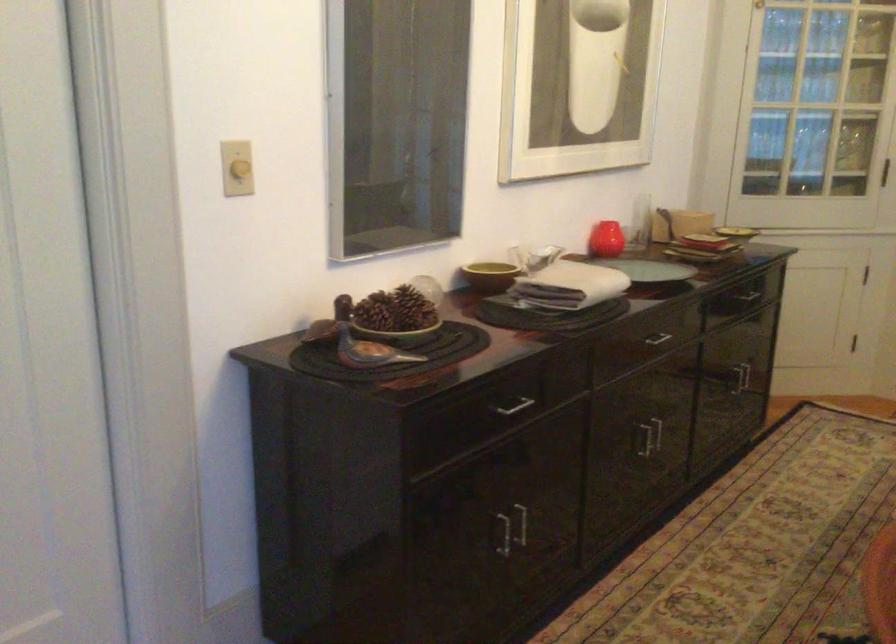
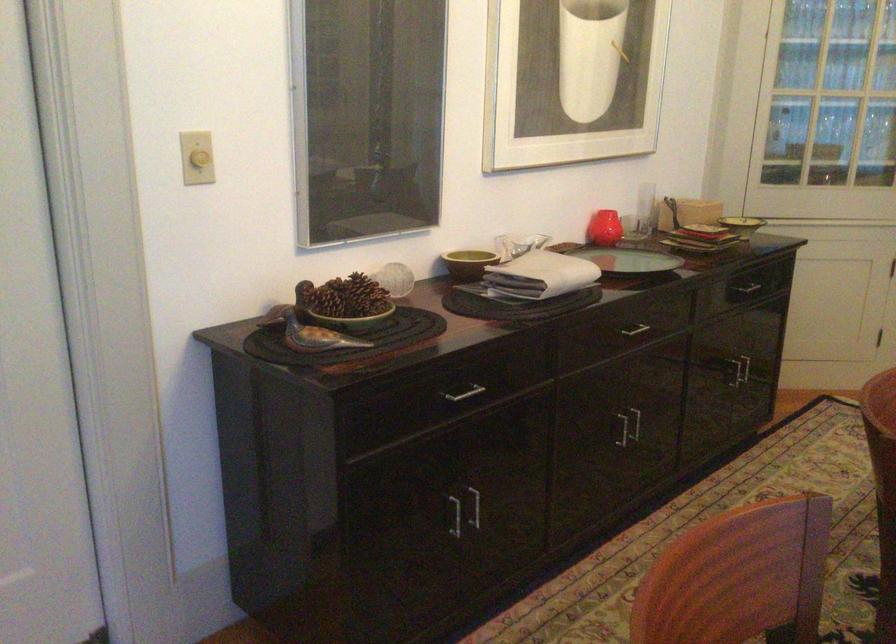
Where in the second image is the point corresponding to (655,433) from the first image?

(635, 422)